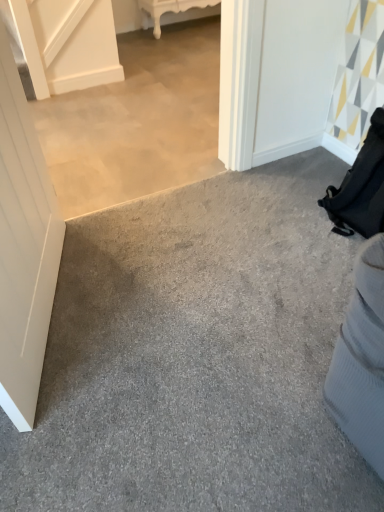
Identify the location of gray carpet at lower right. The width and height of the screenshot is (384, 512). (196, 356).

What do you see at coordinates (172, 11) in the screenshot?
I see `white glossy table at upper center` at bounding box center [172, 11].

What is the approximate width of white matte door at left?

It is 4.40 inches.

The width and height of the screenshot is (384, 512). Find the location of `gray carpet at lower right`. gray carpet at lower right is located at coordinates (196, 356).

Considering the positions of objects white glossy table at upper center and white matte door at left in the image provided, who is behind, white glossy table at upper center or white matte door at left?

white glossy table at upper center is further away from the camera.

Does white glossy table at upper center have a greater height compared to white matte door at left?

No.

Is white glossy table at upper center located outside white matte door at left?

Indeed, white glossy table at upper center is completely outside white matte door at left.

Considering the points (192, 1) and (23, 106), which point is behind, point (192, 1) or point (23, 106)?

The point (192, 1) is behind.

Is the surface of gray carpet at lower right in direct contact with white glossy table at upper center?

No, gray carpet at lower right is not next to white glossy table at upper center.

Would you say gray carpet at lower right is inside or outside white glossy table at upper center?

The correct answer is: outside.

From a real-world perspective, is gray carpet at lower right located higher than white glossy table at upper center?

No, from a real-world perspective, gray carpet at lower right is not above white glossy table at upper center.

Who is smaller, gray carpet at lower right or white glossy table at upper center?

With smaller size is white glossy table at upper center.

In the image, is white glossy table at upper center positioned in front of or behind gray carpet at lower right?

In the image, white glossy table at upper center appears behind gray carpet at lower right.

In terms of size, does white glossy table at upper center appear bigger or smaller than gray carpet at lower right?

white glossy table at upper center is smaller than gray carpet at lower right.

Is white glossy table at upper center next to gray carpet at lower right?

They are not placed beside each other.

Is gray carpet at lower right bigger or smaller than white matte door at left?

gray carpet at lower right is bigger than white matte door at left.

Which is closer to the camera, (295, 185) or (11, 99)?

Point (295, 185) is positioned farther from the camera compared to point (11, 99).

In the scene shown: Considering the relative positions of gray carpet at lower right and white matte door at left in the image provided, is gray carpet at lower right to the left of white matte door at left from the viewer's perspective?

No.

How much distance is there between gray carpet at lower right and white matte door at left?

gray carpet at lower right is 15.30 inches from white matte door at left.

Between white matte door at left and gray carpet at lower right, which one is positioned behind?

Positioned behind is gray carpet at lower right.

Could you tell me if white matte door at left is facing gray carpet at lower right?

Yes, white matte door at left is turned towards gray carpet at lower right.

The image size is (384, 512). I want to click on door that appears in front of the gray carpet at lower right, so click(24, 248).

Choose the correct answer: Is white matte door at left inside gray carpet at lower right or outside it?

The correct answer is: outside.

Consider the image. Is white matte door at left next to white glossy table at upper center and touching it?

No, white matte door at left is not next to white glossy table at upper center.

Is the depth of white matte door at left greater than that of white glossy table at upper center?

No, it is not.

Is white matte door at left positioned beyond the bounds of white glossy table at upper center?

Absolutely, white matte door at left is external to white glossy table at upper center.

Where is `furniture behind the white matte door at left`? The width and height of the screenshot is (384, 512). furniture behind the white matte door at left is located at coordinates (172, 11).

What are the coordinates of `furniture lying on the left of gray carpet at lower right` in the screenshot? It's located at click(x=172, y=11).

Estimate the real-world distances between objects in this image. Which object is closer to white glossy table at upper center, white matte door at left or gray carpet at lower right?

white matte door at left is positioned closer to the anchor white glossy table at upper center.

When comparing their distances from white glossy table at upper center, does gray carpet at lower right or white matte door at left seem further?

Based on the image, gray carpet at lower right appears to be further to white glossy table at upper center.

Which object lies further to the anchor point gray carpet at lower right, white matte door at left or white glossy table at upper center?

Based on the image, white glossy table at upper center appears to be further to gray carpet at lower right.

When comparing their distances from white matte door at left, does gray carpet at lower right or white glossy table at upper center seem further?

Based on the image, white glossy table at upper center appears to be further to white matte door at left.

Based on their spatial positions, is white glossy table at upper center or white matte door at left closer to gray carpet at lower right?

Among the two, white matte door at left is located nearer to gray carpet at lower right.

Looking at the image, which one is located closer to white matte door at left, white glossy table at upper center or gray carpet at lower right?

The object closer to white matte door at left is gray carpet at lower right.

This screenshot has height=512, width=384. I want to click on concrete between white matte door at left and white glossy table at upper center in the front-back direction, so click(196, 356).